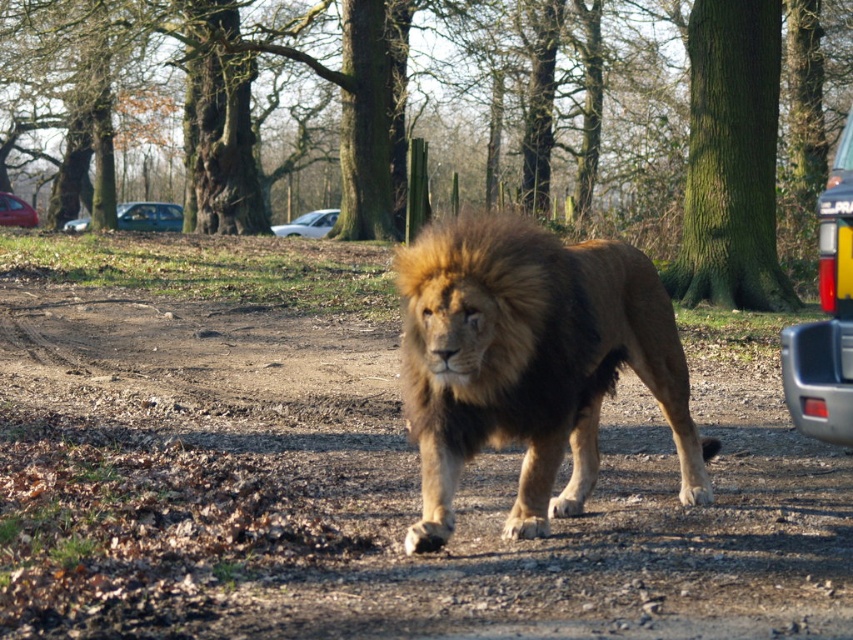
Question: Is metallic blue sedan at left above white matte car at center?

Choices:
 (A) no
 (B) yes

Answer: (A)

Question: Which point is closer to the camera taking this photo?

Choices:
 (A) (833, 253)
 (B) (74, 225)

Answer: (A)

Question: Which object appears closest to the camera in this image?

Choices:
 (A) metallic blue sedan at left
 (B) metallic silver suv at right
 (C) white matte car at center
 (D) metallic red car at left

Answer: (B)

Question: Which object is closer to the camera taking this photo?

Choices:
 (A) metallic silver suv at right
 (B) brown dirt track at center
 (C) brown furry lion at center
 (D) brown fuzzy mane at center

Answer: (B)

Question: Can you confirm if brown dirt track at center is positioned above metallic silver suv at right?

Choices:
 (A) no
 (B) yes

Answer: (A)

Question: In this image, where is metallic silver suv at right located relative to white matte car at center?

Choices:
 (A) below
 (B) above

Answer: (A)